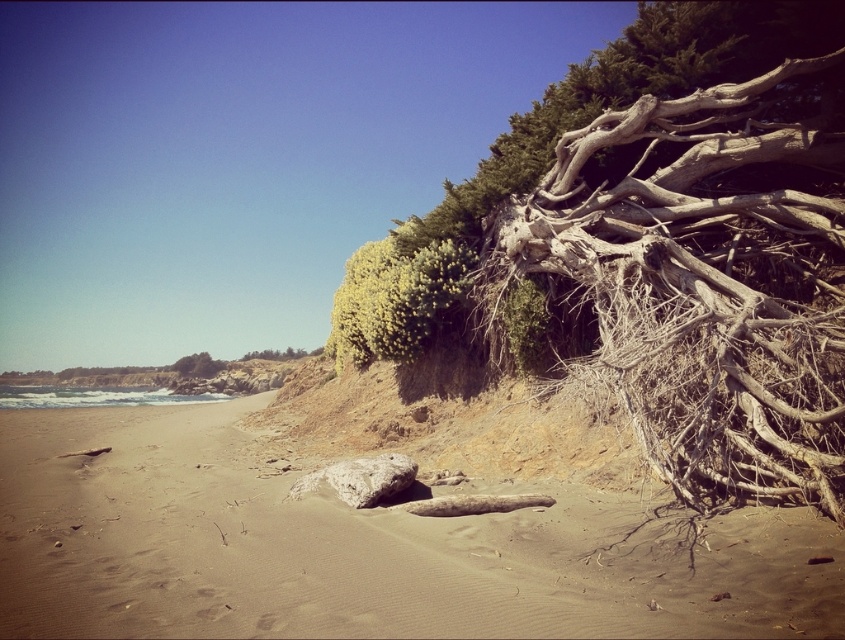
Question: Does brown sandy beach at lower center appear under gray rough rock at center?

Choices:
 (A) yes
 (B) no

Answer: (A)

Question: Is brown sandy beach at lower center below driftwood at upper right?

Choices:
 (A) no
 (B) yes

Answer: (B)

Question: Does brown sandy beach at lower center appear under driftwood at upper right?

Choices:
 (A) yes
 (B) no

Answer: (A)

Question: Which object is the closest to the brown sandy beach at lower center?

Choices:
 (A) driftwood at upper right
 (B) gray rough rock at center

Answer: (B)

Question: Which of the following is the farthest from the observer?

Choices:
 (A) (842, 93)
 (B) (391, 452)
 (C) (462, 541)

Answer: (B)

Question: Among these objects, which one is farthest from the camera?

Choices:
 (A) driftwood at upper right
 (B) brown sandy beach at lower center
 (C) gray rough rock at center

Answer: (A)